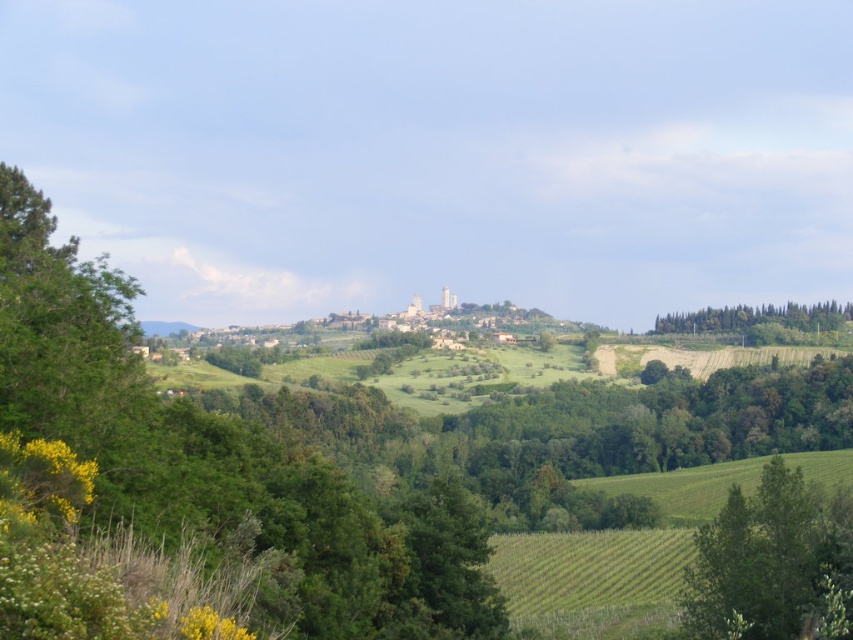
You are standing in the middle of the vineyard in the rural landscape. You see a point marked at coordinates (772,563). What object does this point correspond to?

The point corresponds to the green leafy tree at lower right.

Consider the image. You are standing at the bottom of the hill in the rural landscape scene. You see two points marked on the image. The first point is at coordinate point (846, 570) and the second is at point (695, 323). Which point is closer to you?

Point (846, 570) is in front of point (695, 323), so the first point is closer to you.